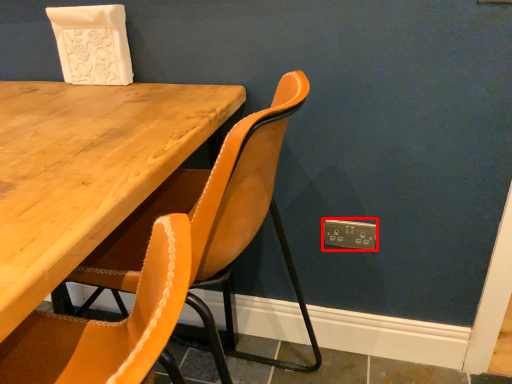
Question: From the image's perspective, what is the correct spatial positioning of electric outlet (annotated by the red box) in reference to chair?

Choices:
 (A) below
 (B) above

Answer: (B)